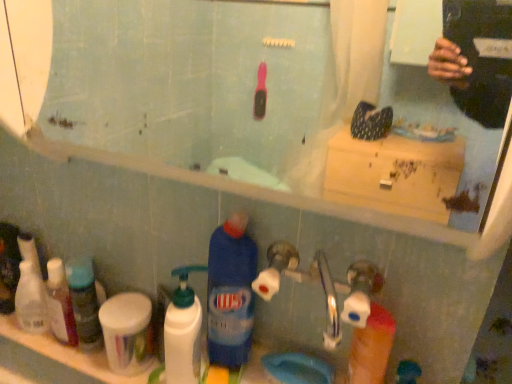
Question: Is blue plastic bottle at lower center, which is counted as the 1th cleaning product, starting from the right, facing away from white plastic pump bottle at lower left, placed as the 2th cleaning product when sorted from right to left?

Choices:
 (A) yes
 (B) no

Answer: (B)

Question: From the image's perspective, is blue plastic bottle at lower center, which is counted as the 1th cleaning product, starting from the right, below white plastic pump bottle at lower left, the 1th cleaning product in the left-to-right sequence?

Choices:
 (A) no
 (B) yes

Answer: (A)

Question: Considering the relative sizes of blue plastic bottle at lower center, the second cleaning product from the left, and white plastic pump bottle at lower left, placed as the 2th cleaning product when sorted from right to left, in the image provided, is blue plastic bottle at lower center, the second cleaning product from the left, thinner than white plastic pump bottle at lower left, placed as the 2th cleaning product when sorted from right to left,?

Choices:
 (A) yes
 (B) no

Answer: (B)

Question: Does blue plastic bottle at lower center, the second cleaning product from the left, have a greater width compared to white plastic pump bottle at lower left, the 1th cleaning product in the left-to-right sequence?

Choices:
 (A) yes
 (B) no

Answer: (A)

Question: Does blue plastic bottle at lower center, which is counted as the 1th cleaning product, starting from the right, have a lesser height compared to white plastic pump bottle at lower left, the 1th cleaning product in the left-to-right sequence?

Choices:
 (A) no
 (B) yes

Answer: (A)

Question: Is blue plastic bottle at lower center, which is counted as the 1th cleaning product, starting from the right, spatially inside white plastic bottles at left, which appears as the first toiletry when viewed from the left, or outside of it?

Choices:
 (A) inside
 (B) outside

Answer: (B)

Question: In the image, is blue plastic bottle at lower center, the second cleaning product from the left, on the left side or the right side of white plastic bottles at left, which appears as the first toiletry when viewed from the left?

Choices:
 (A) right
 (B) left

Answer: (A)

Question: Is blue plastic bottle at lower center, the second cleaning product from the left, taller or shorter than white plastic bottles at left, which appears as the first toiletry when viewed from the left?

Choices:
 (A) short
 (B) tall

Answer: (B)

Question: In terms of size, does blue plastic bottle at lower center, the second cleaning product from the left, appear bigger or smaller than white plastic bottles at left, the 3th toiletry viewed from the right?

Choices:
 (A) big
 (B) small

Answer: (A)

Question: Considering their positions, is white plastic pump bottle at lower left, the 1th cleaning product in the left-to-right sequence, located in front of or behind white plastic bottles at left, which appears as the first toiletry when viewed from the left?

Choices:
 (A) front
 (B) behind

Answer: (A)

Question: Do you think white plastic pump bottle at lower left, the 1th cleaning product in the left-to-right sequence, is within white plastic bottles at left, which appears as the first toiletry when viewed from the left, or outside of it?

Choices:
 (A) outside
 (B) inside

Answer: (A)

Question: Is point 198,350 positioned closer to the camera than point 24,266?

Choices:
 (A) farther
 (B) closer

Answer: (B)

Question: From a real-world perspective, is white plastic pump bottle at lower left, placed as the 2th cleaning product when sorted from right to left, physically located above or below white plastic bottles at left, which appears as the first toiletry when viewed from the left?

Choices:
 (A) below
 (B) above

Answer: (B)

Question: From their relative heights in the image, would you say translucent plastic bottles at left, which is the second toiletry in left-to-right order, is taller or shorter than white plastic bottles at left, which appears as the first toiletry when viewed from the left?

Choices:
 (A) short
 (B) tall

Answer: (B)

Question: Do you think translucent plastic bottles at left, which is the second toiletry in left-to-right order, is within white plastic bottles at left, which appears as the first toiletry when viewed from the left, or outside of it?

Choices:
 (A) outside
 (B) inside

Answer: (A)